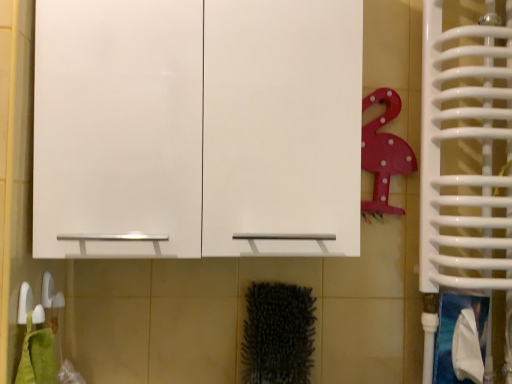
What do you see at coordinates (197, 128) in the screenshot? I see `white glossy cabinet at upper center` at bounding box center [197, 128].

Identify the location of white glossy cabinet at upper center. (197, 128).

The image size is (512, 384). I want to click on white glossy cabinet at upper center, so click(197, 128).